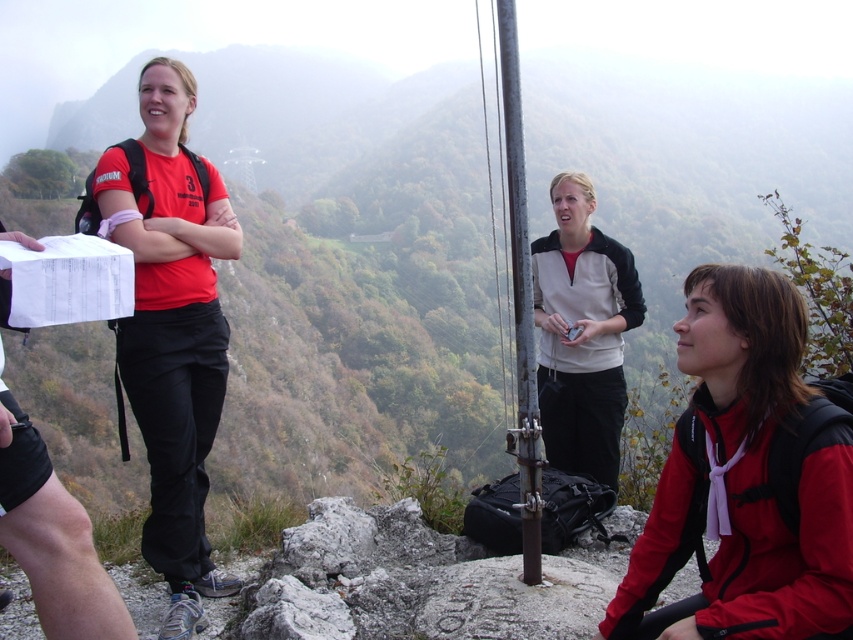
You are a hiker who needs to reach the metallic pole at center from your current position near the matte red shirt at left. Can you walk directly to the pole without any obstacles in between?

The distance between the matte red shirt at left and the metallic pole at center is 5.30 feet, so yes, you can walk directly to the pole without any obstacles in between.

You are a hiker trying to reach the summit. You see a white fleece jacket at center and a metallic pole at center. Which object is closer to you?

The white fleece jacket at center is closer to you because it is further to the viewer than the metallic pole at center.